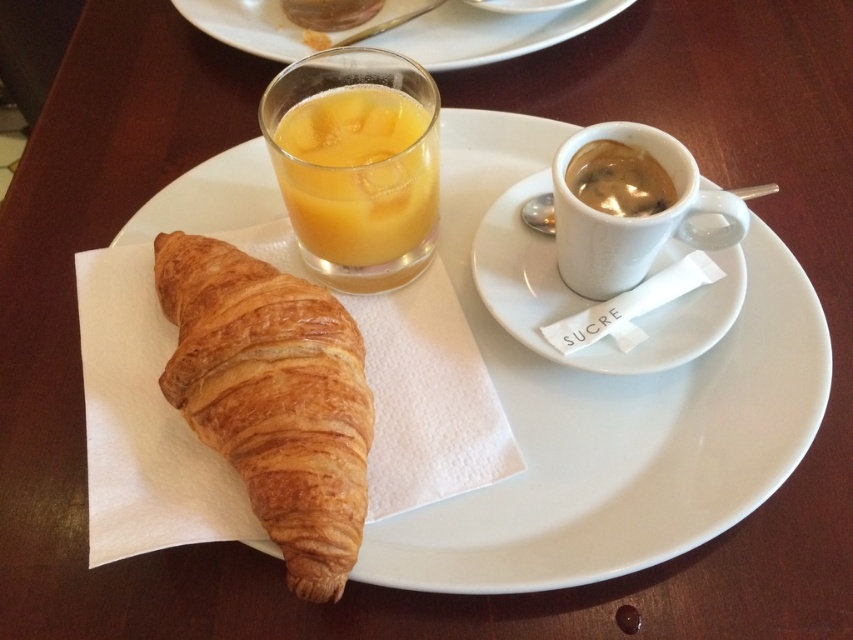
Identify the location of white ceramic plate at center. This screenshot has height=640, width=853. (606, 416).

Is white ceramic plate at center to the left of white ceramic saucer at upper center from the viewer's perspective?

Yes, white ceramic plate at center is to the left of white ceramic saucer at upper center.

Does point (625, 570) come farther from viewer compared to point (537, 289)?

No.

Locate an element on the screen. white ceramic plate at center is located at coordinates (606, 416).

Is golden brown flaky croissant at left to the left of white ceramic saucer at upper center from the viewer's perspective?

Correct, you'll find golden brown flaky croissant at left to the left of white ceramic saucer at upper center.

Who is taller, golden brown flaky croissant at left or white ceramic saucer at upper center?

golden brown flaky croissant at left

You are a GUI agent. You are given a task and a screenshot of the screen. Output one action in this format:
    pyautogui.click(x=<x>, y=<y>)
    Task: Click on the golden brown flaky croissant at left
    Image resolution: width=853 pixels, height=640 pixels.
    Given the screenshot: What is the action you would take?
    pyautogui.click(x=271, y=397)

Who is lower down, translucent glass orange juice at center or matte glass at upper center?

translucent glass orange juice at center

Is translucent glass orange juice at center bigger than matte glass at upper center?

Incorrect, translucent glass orange juice at center is not larger than matte glass at upper center.

The image size is (853, 640). What are the coordinates of `translucent glass orange juice at center` in the screenshot? It's located at (358, 173).